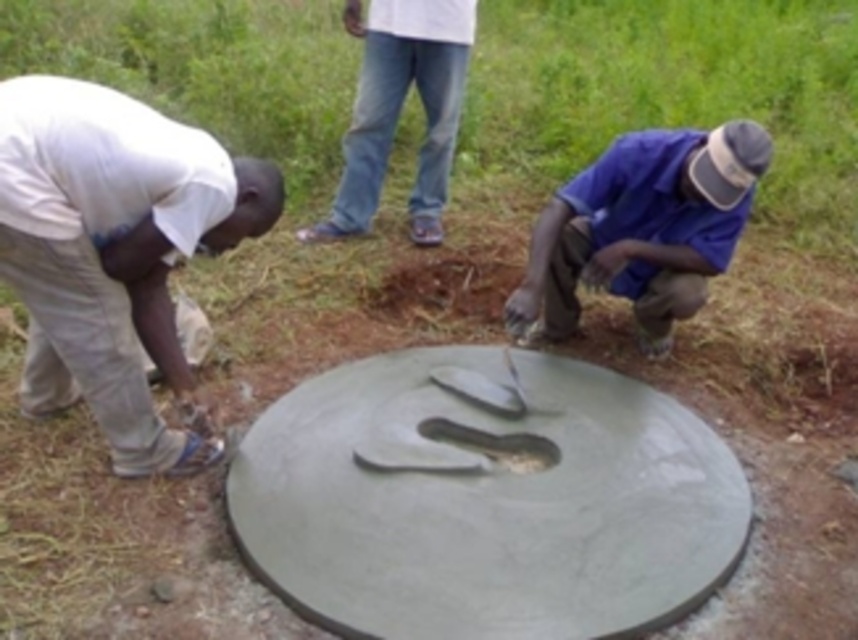
Can you confirm if gray concrete manhole at center is positioned below white denim jeans at upper center?

Indeed, gray concrete manhole at center is positioned under white denim jeans at upper center.

Can you confirm if gray concrete manhole at center is shorter than white denim jeans at upper center?

Yes, gray concrete manhole at center is shorter than white denim jeans at upper center.

What do you see at coordinates (486, 502) in the screenshot? The width and height of the screenshot is (858, 640). I see `gray concrete manhole at center` at bounding box center [486, 502].

Locate an element on the screen. gray concrete manhole at center is located at coordinates (486, 502).

Which is below, blue matte shirt at right or white denim jeans at upper center?

Positioned lower is blue matte shirt at right.

Who is more distant from viewer, (x=554, y=218) or (x=337, y=218)?

Point (x=337, y=218)

The image size is (858, 640). Find the location of `blue matte shirt at right`. blue matte shirt at right is located at coordinates pos(642,227).

Identify the location of blue matte shirt at right. (642, 227).

Image resolution: width=858 pixels, height=640 pixels. What do you see at coordinates (113, 252) in the screenshot?
I see `white matte shirt at left` at bounding box center [113, 252].

Between white matte shirt at left and green concrete manhole at center, which one appears on the right side from the viewer's perspective?

green concrete manhole at center is more to the right.

Which is behind, point (204, 216) or point (406, 280)?

The point (406, 280) is behind.

Locate an element on the screen. The image size is (858, 640). white matte shirt at left is located at coordinates (113, 252).